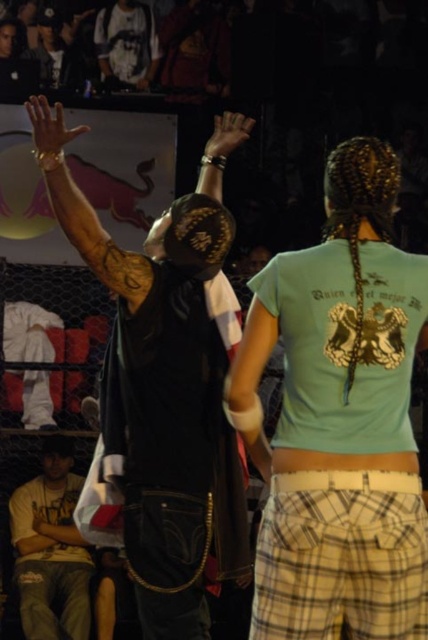
You are standing at the event and want to reach the point marked as point (50, 173). If your walking speed is 3 feet per second, how many seconds will it take you to reach that point?

The distance between you and point (50, 173) is 16.31 feet. At a speed of 3 feet per second, it will take approximately 5.44 seconds to reach the point.

You are standing in the crowd watching the event. Which object is closer to you, the denim pants at lower left or the white fabric shirt at upper center?

The denim pants at lower left is closer to the viewer than the white fabric shirt at upper center.